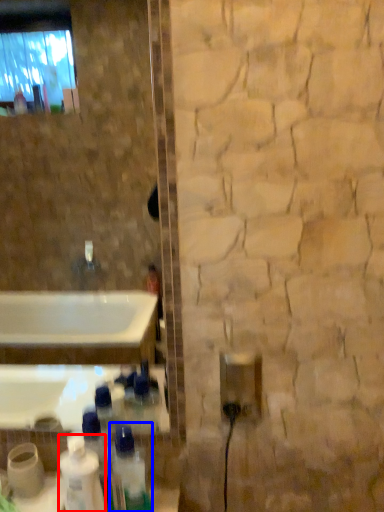
Question: Which point is closer to the camera, cleaning product (highlighted by a red box) or bottle (highlighted by a blue box)?

Choices:
 (A) cleaning product
 (B) bottle

Answer: (A)